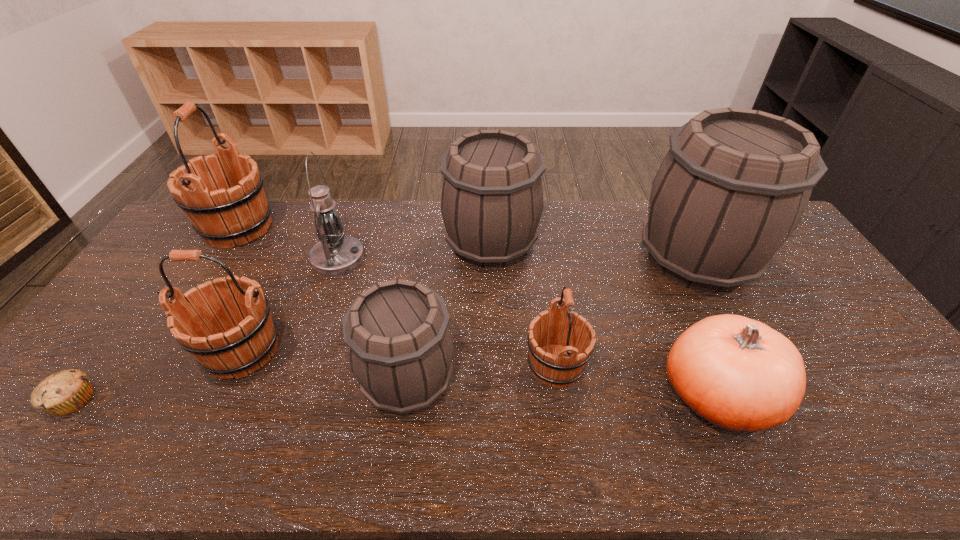
This screenshot has width=960, height=540. I want to click on wood wine bucket that stands as the closest to the nearest brown wine bucket, so (551, 362).

Identify which brown wine bucket is the second nearest to the farthest wood wine bucket. Please provide its 2D coordinates. Your answer should be formatted as a tuple, i.e. [(x, y)], where the tuple contains the x and y coordinates of a point satisfying the conditions above.

[(492, 196)]

Where is `the closest brown wine bucket relative to the rightmost wine bucket`? This screenshot has width=960, height=540. the closest brown wine bucket relative to the rightmost wine bucket is located at coordinates (492, 196).

Where is `vacant space that satisfies the following two spatial constraints: 1. on the front side of the second smallest brown wine bucket; 2. on the right side of the rightmost wood wine bucket`? vacant space that satisfies the following two spatial constraints: 1. on the front side of the second smallest brown wine bucket; 2. on the right side of the rightmost wood wine bucket is located at coordinates (494, 366).

The height and width of the screenshot is (540, 960). What are the coordinates of `free location that satisfies the following two spatial constraints: 1. on the back side of the biggest brown wine bucket; 2. on the right side of the second smallest wood wine bucket` in the screenshot? It's located at (286, 259).